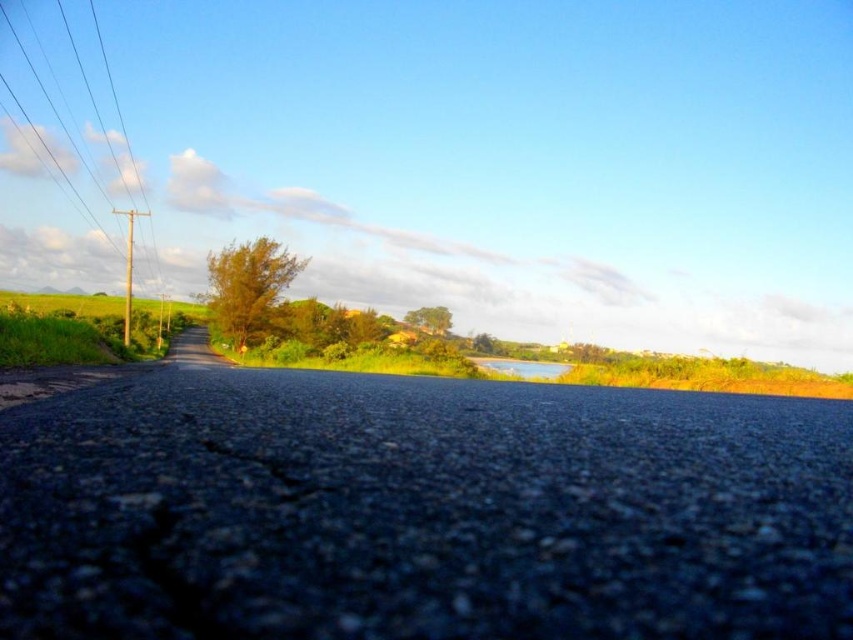
Locate an element on the screen. dark asphalt crack at center is located at coordinates (270, 468).

In the scene shown: Does dark asphalt crack at center appear over green leafy tree at center?

Incorrect, dark asphalt crack at center is not positioned above green leafy tree at center.

Who is more forward, (233, 451) or (410, 317)?

Point (233, 451) is more forward.

The height and width of the screenshot is (640, 853). What are the coordinates of `dark asphalt crack at center` in the screenshot? It's located at (270, 468).

Identify the location of smooth wood pole at left. The image size is (853, 640). (68, 109).

How far apart are smooth wood pole at left and dark asphalt crack at center?

smooth wood pole at left and dark asphalt crack at center are 246.84 meters apart.

Between point (61, 76) and point (267, 474), which one is positioned behind?

Point (61, 76)

At what (x,y) coordinates should I click in order to perform the action: click on smooth wood pole at left. Please return your answer as a coordinate pair (x, y). The width and height of the screenshot is (853, 640). Looking at the image, I should click on (68, 109).

Can you confirm if smooth wood pole at left is taller than green leafy bush at center?

Yes, smooth wood pole at left is taller than green leafy bush at center.

Is point (117, 134) positioned after point (265, 296)?

Yes, point (117, 134) is behind point (265, 296).

Who is more forward, (128, 147) or (231, 291)?

Point (231, 291)

Find the location of a particular element. smooth wood pole at left is located at coordinates (68, 109).